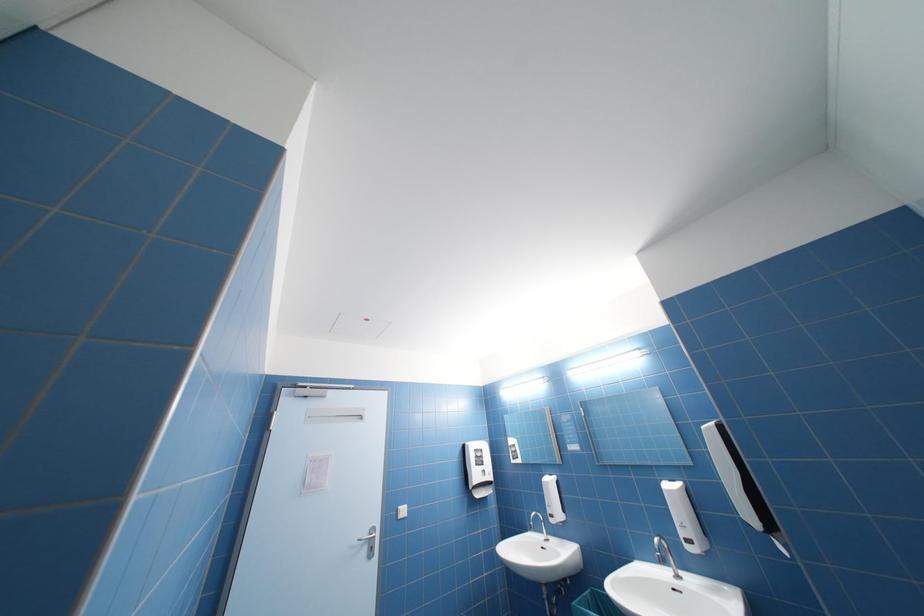
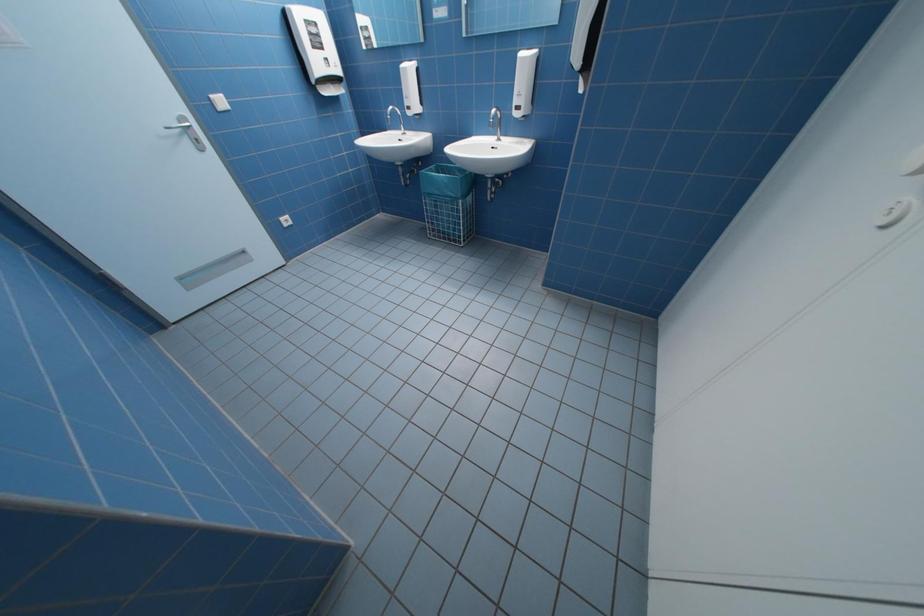
Based on the continuous images, in which direction is the camera rotating?

The rotation direction of the camera is right-down.